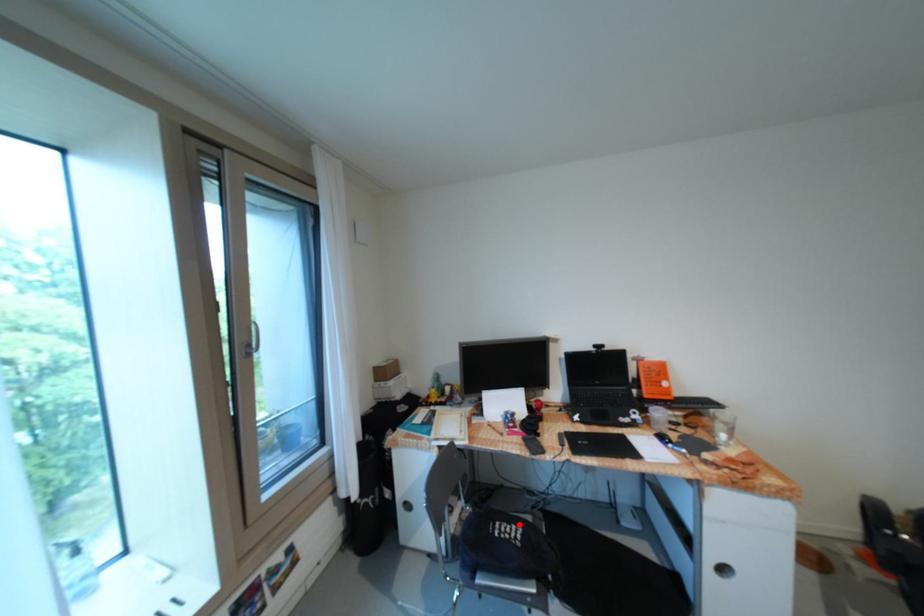
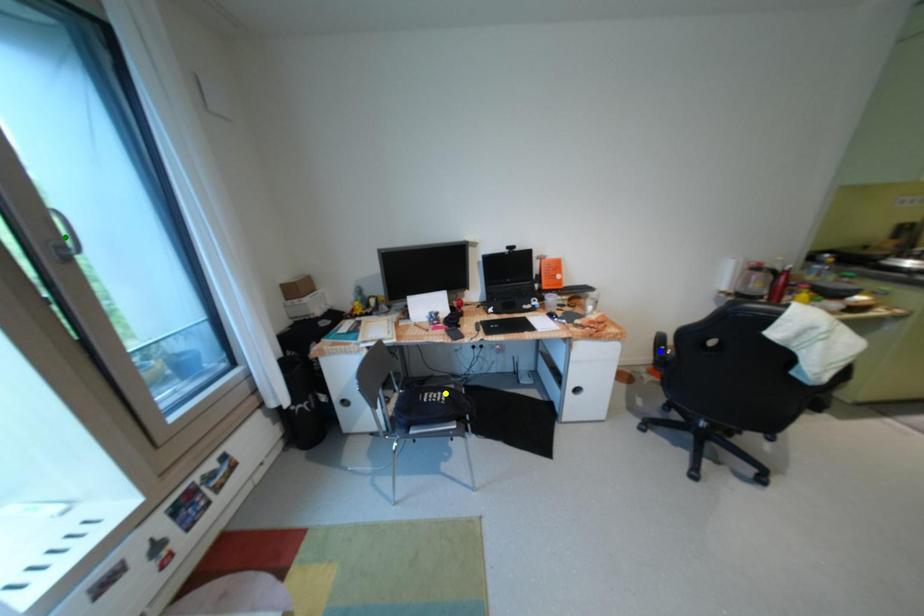
Question: I am providing you with two images of the same scene from different viewpoints. A red point is marked on the first image. You are given multiple points on the second image. Which point in image 2 is actually the same real-world point as the red point in image 1?

Choices:
 (A) blue point
 (B) green point
 (C) yellow point

Answer: (C)